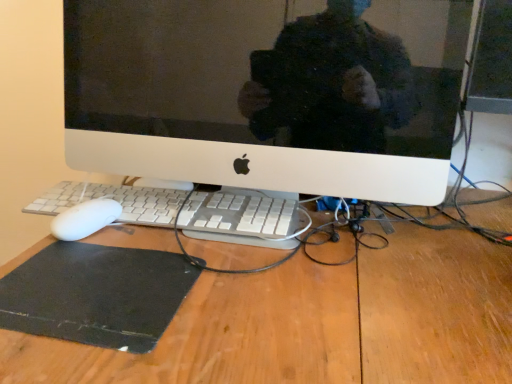
The image size is (512, 384). Identify the location of vacant space in front of white plastic computer monitor at center. (279, 304).